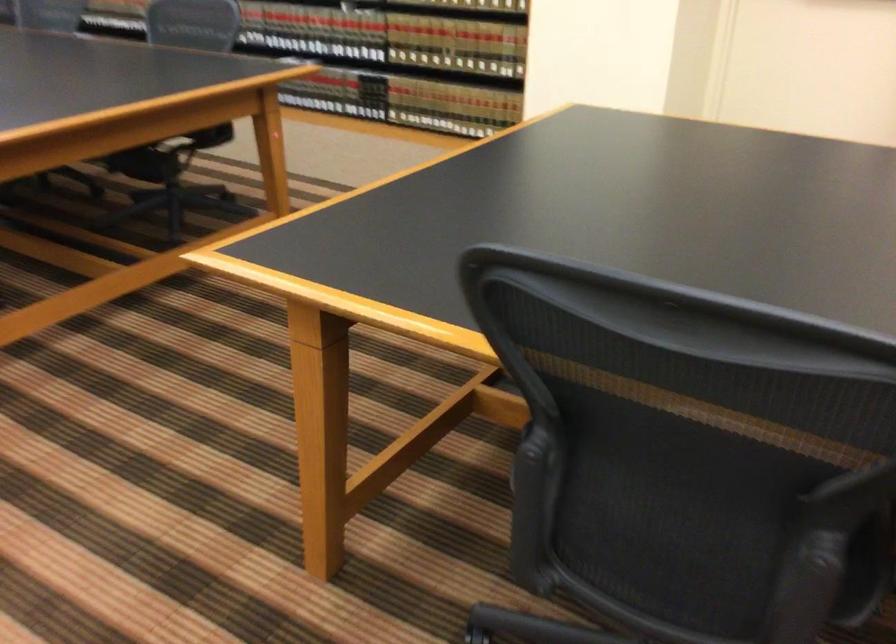
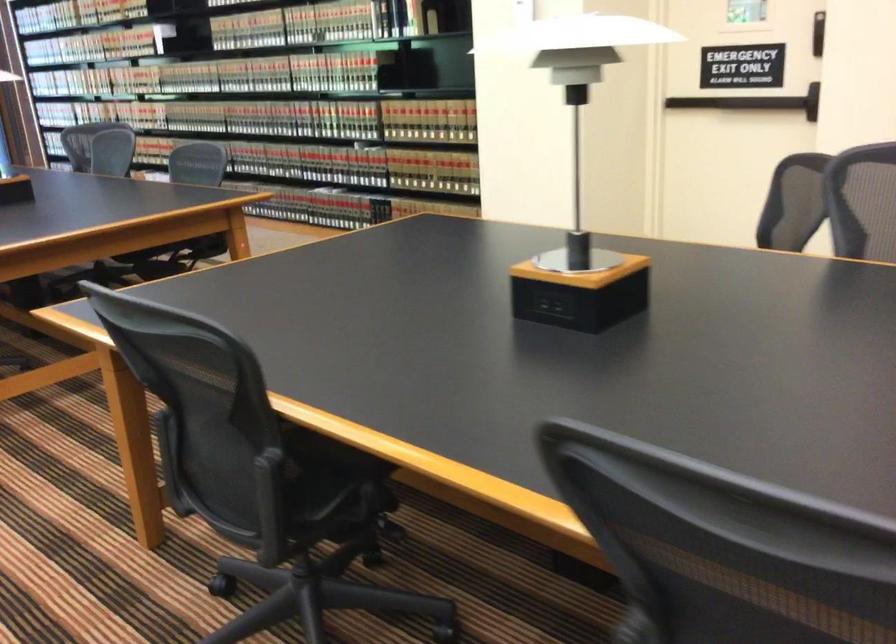
The point at (780, 540) is marked in the first image. Where is the corresponding point in the second image?

(336, 482)